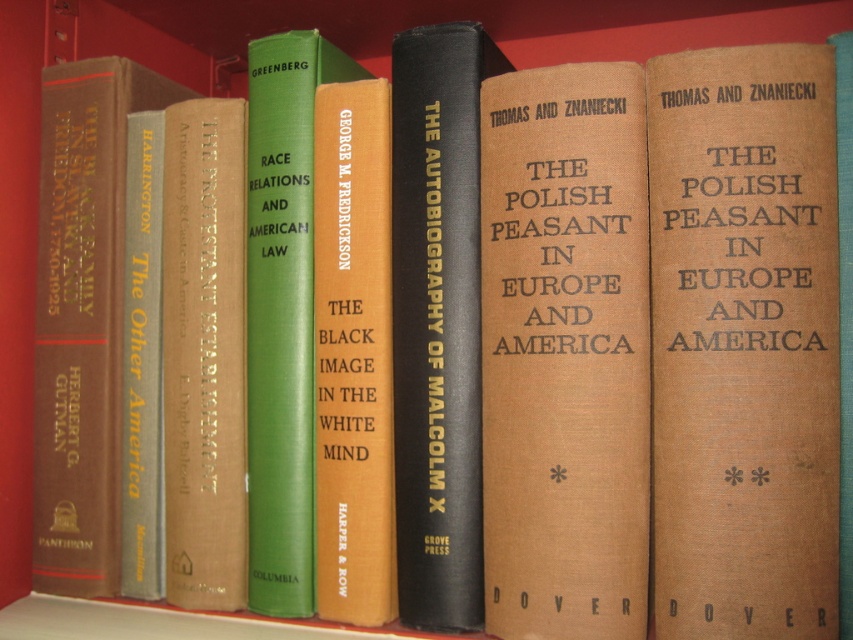
Who is shorter, hardcover book at center or green hardcover book at center?

Standing shorter between the two is hardcover book at center.

Between point (457, 484) and point (300, 186), which one is positioned behind?

The point (300, 186) is more distant.

Does point (462, 218) come closer to viewer compared to point (302, 157)?

Yes, point (462, 218) is in front of point (302, 157).

Find the location of a particular element. The width and height of the screenshot is (853, 640). hardcover book at center is located at coordinates [437, 321].

Which is in front, point (820, 506) or point (97, 179)?

Positioned in front is point (820, 506).

The width and height of the screenshot is (853, 640). What do you see at coordinates (744, 342) in the screenshot?
I see `brown textured book at right` at bounding box center [744, 342].

Does point (833, 128) come behind point (67, 170)?

No, (833, 128) is closer to viewer.

The width and height of the screenshot is (853, 640). What are the coordinates of `brown textured book at right` in the screenshot? It's located at (744, 342).

Does brown leather book at left appear under green hardcover book at center?

Correct, brown leather book at left is located below green hardcover book at center.

Measure the distance between brown leather book at left and green hardcover book at center.

brown leather book at left and green hardcover book at center are 6.25 inches apart from each other.

Is point (39, 276) closer to viewer compared to point (294, 566)?

No, (39, 276) is further to viewer.

The width and height of the screenshot is (853, 640). In order to click on brown leather book at left in this screenshot , I will do `click(82, 317)`.